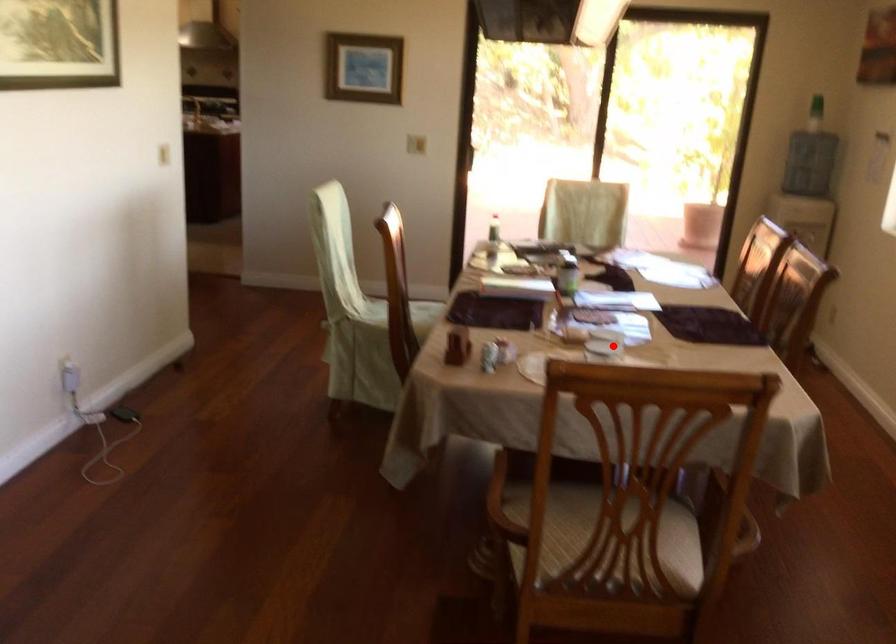
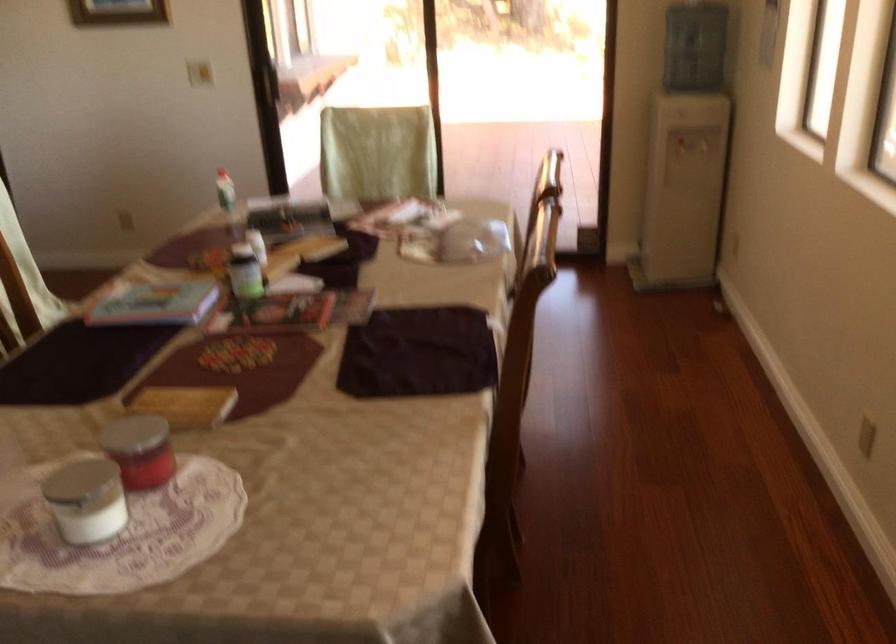
Where in the second image is the point corresponding to the highlighted location from the first image?

(149, 458)